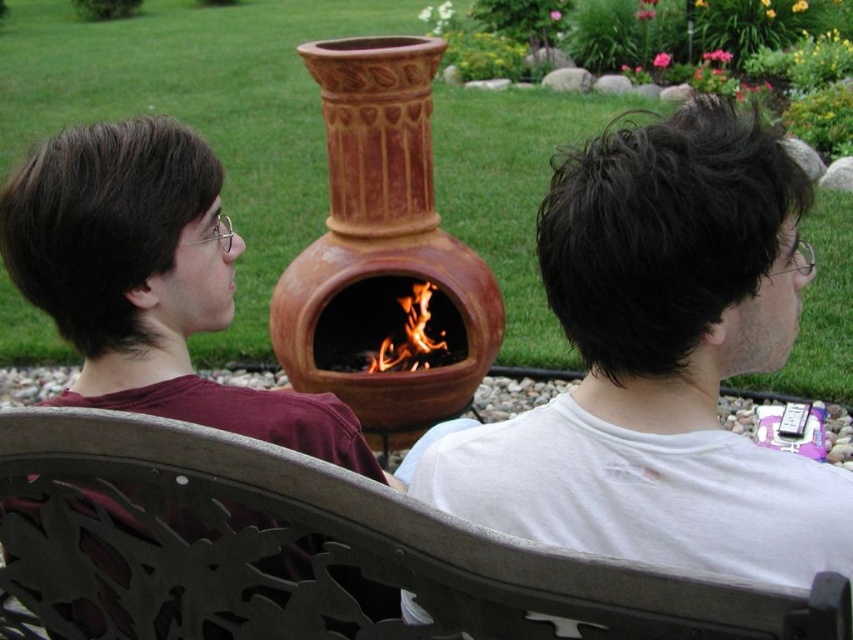
Question: Which of the following is the farthest from the observer?

Choices:
 (A) (468, 365)
 (B) (100, 280)
 (C) (466, 552)

Answer: (A)

Question: Which of the following is the farthest from the observer?

Choices:
 (A) white cotton shirt at center
 (B) flamewoodenfire at center

Answer: (B)

Question: Is metallic gray chair at lower center thinner than white cotton shirt at center?

Choices:
 (A) no
 (B) yes

Answer: (A)

Question: Is metallic gray chair at lower center below white cotton shirt at center?

Choices:
 (A) yes
 (B) no

Answer: (A)

Question: Among these points, which one is farthest from the camera?

Choices:
 (A) (366, 502)
 (B) (386, 358)
 (C) (343, 131)
 (D) (90, 273)

Answer: (B)

Question: Does white cotton shirt at center have a lesser width compared to flamewoodenfire at center?

Choices:
 (A) yes
 (B) no

Answer: (B)